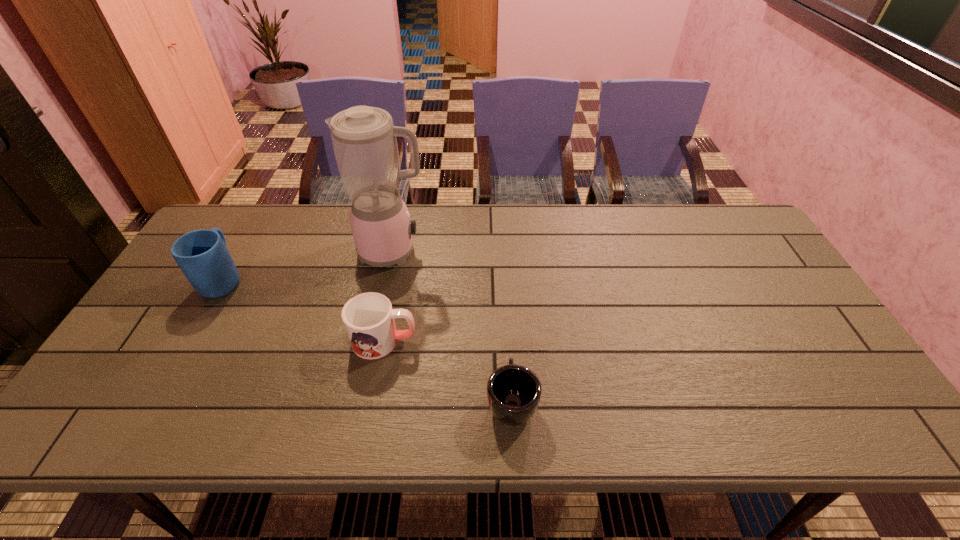
Identify the location of vacant space at the right edge. The width and height of the screenshot is (960, 540). (737, 273).

Where is `blank space at the far left corner`? blank space at the far left corner is located at coordinates pyautogui.click(x=222, y=223).

What are the coordinates of `vacant position at the far right corner of the desktop` in the screenshot? It's located at (742, 234).

This screenshot has height=540, width=960. In order to click on empty space that is in between the second mug from left to right and the tallest object in this screenshot , I will do `click(389, 296)`.

Image resolution: width=960 pixels, height=540 pixels. I want to click on empty space between the farthest mug and the food processor, so click(308, 265).

The width and height of the screenshot is (960, 540). In order to click on vacant point located between the leftmost object and the tallest object in this screenshot , I will do `click(308, 265)`.

Identify the location of blank region between the second nearest object and the tallest object. 389,296.

The height and width of the screenshot is (540, 960). I want to click on blank region between the shortest object and the tallest object, so click(452, 326).

Identify the location of free space between the second mug from right to left and the food processor. The width and height of the screenshot is (960, 540). (389, 296).

You are a GUI agent. You are given a task and a screenshot of the screen. Output one action in this format:
    pyautogui.click(x=<x>, y=<y>)
    Task: Click on the blank region between the farthest mug and the tallest object
    
    Given the screenshot: What is the action you would take?
    pyautogui.click(x=308, y=265)